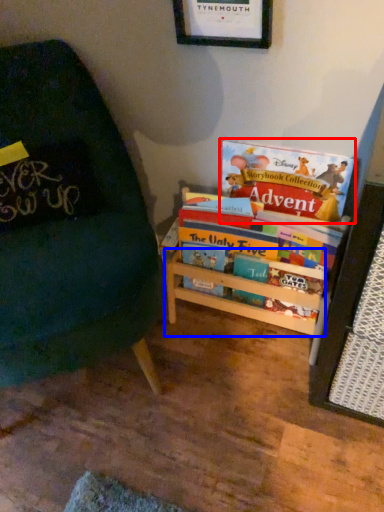
Question: Among these objects, which one is farthest to the camera, book (highlighted by a red box) or shelf (highlighted by a blue box)?

Choices:
 (A) book
 (B) shelf

Answer: (B)